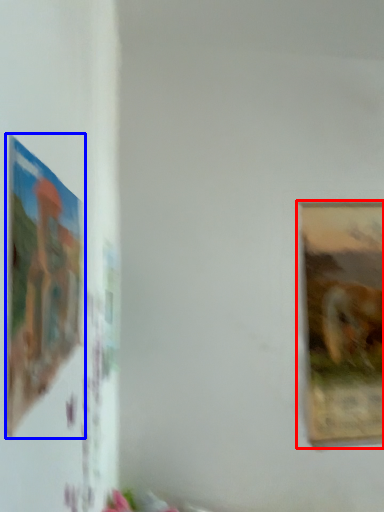
Question: Which point is closer to the camera, picture frame (highlighted by a red box) or picture frame (highlighted by a blue box)?

Choices:
 (A) picture frame
 (B) picture frame

Answer: (B)